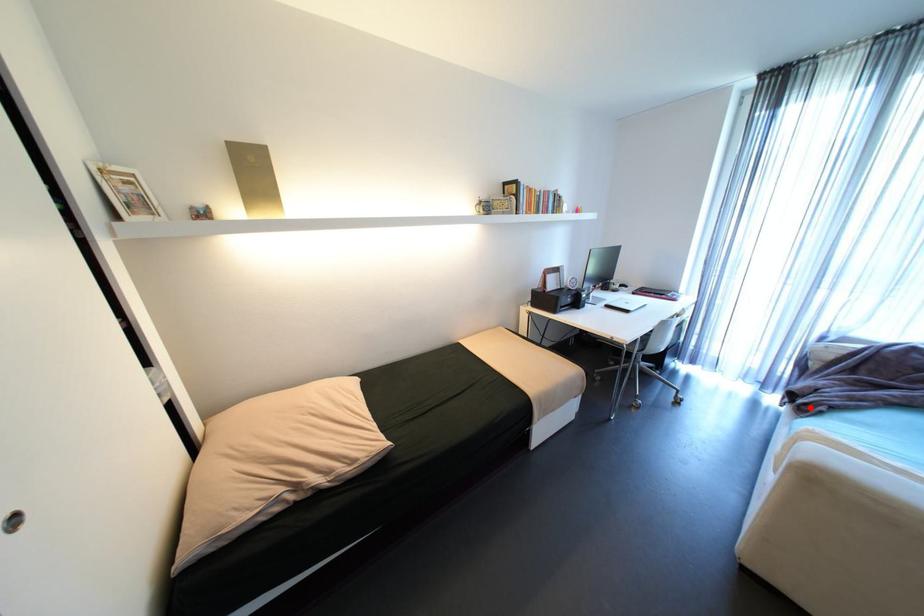
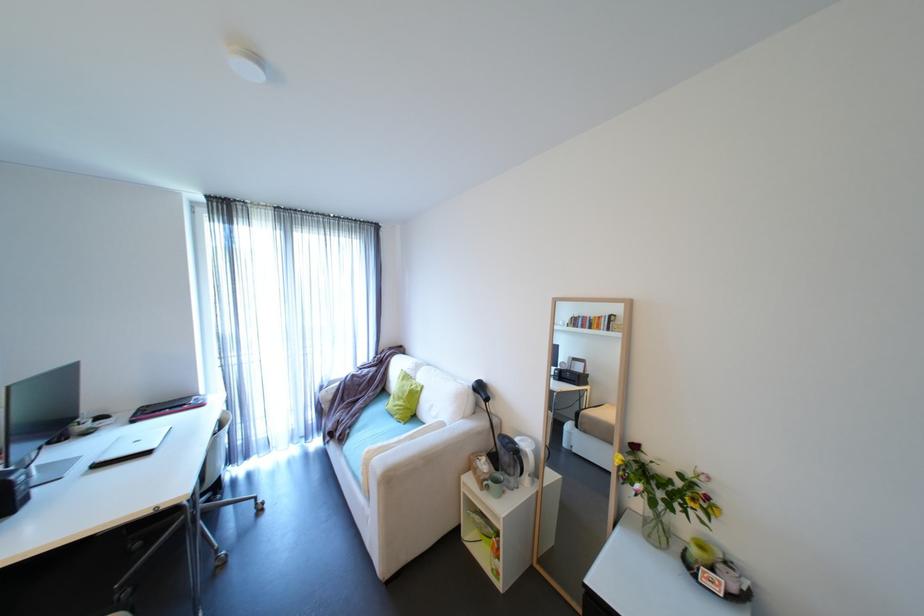
Question: I am providing you with two images of the same scene from different viewpoints. Image1 has a red point marked. In image2, the corresponding 3D location appears at what relative position? Reply with the corresponding letter.

Choices:
 (A) Closer
 (B) Farther

Answer: (B)